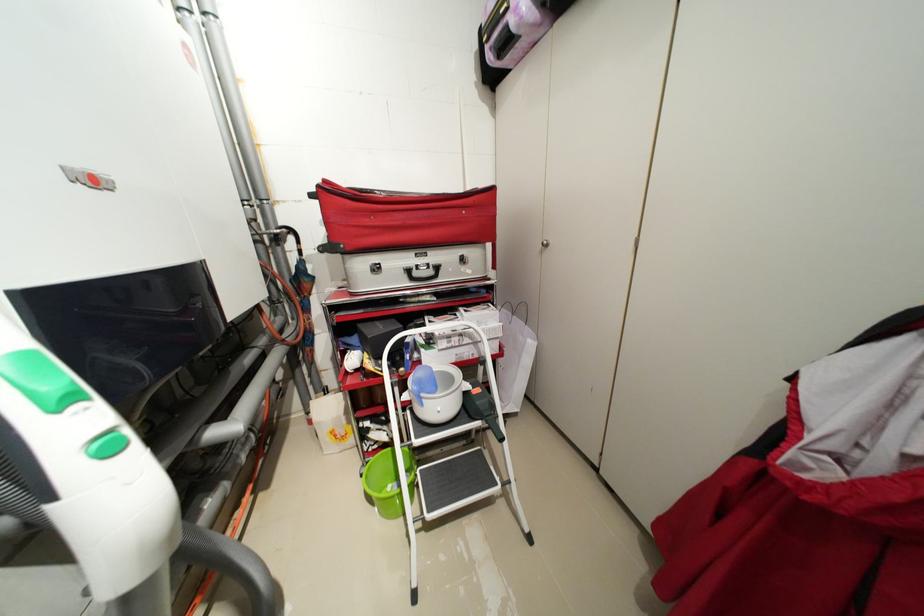
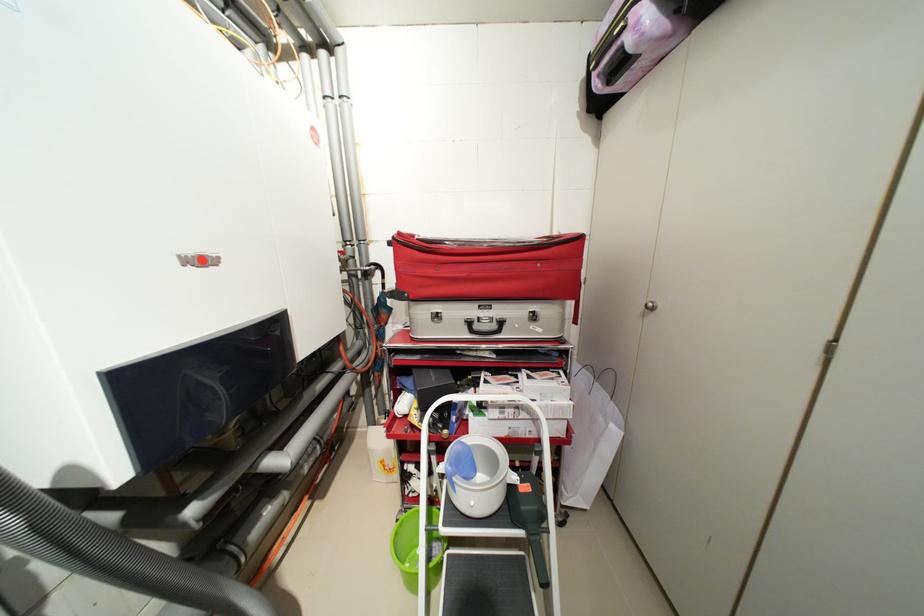
In the second image, find the point that corresponds to point (332, 182) in the first image.

(407, 235)